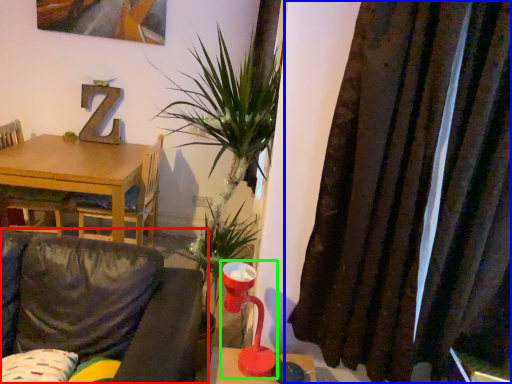
Question: Which is farther away from studio couch (highlighted by a red box)? curtain (highlighted by a blue box) or table lamp (highlighted by a green box)?

Choices:
 (A) curtain
 (B) table lamp

Answer: (A)